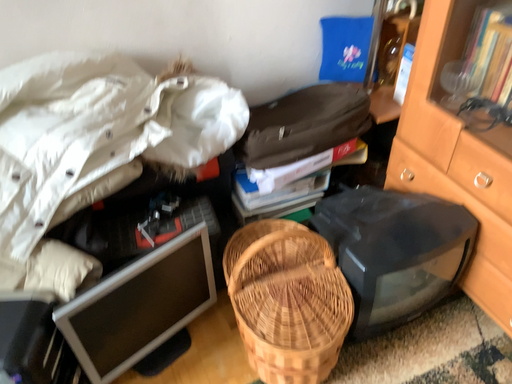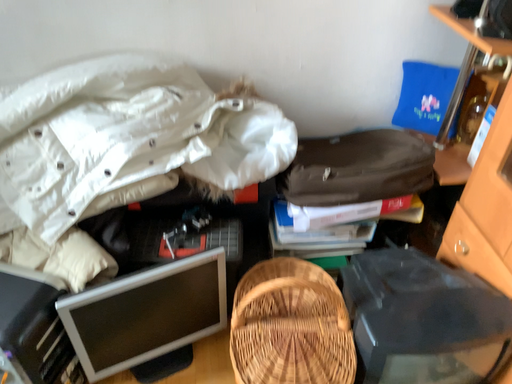
Question: Which way did the camera rotate in the video?

Choices:
 (A) rotated right
 (B) rotated left

Answer: (B)